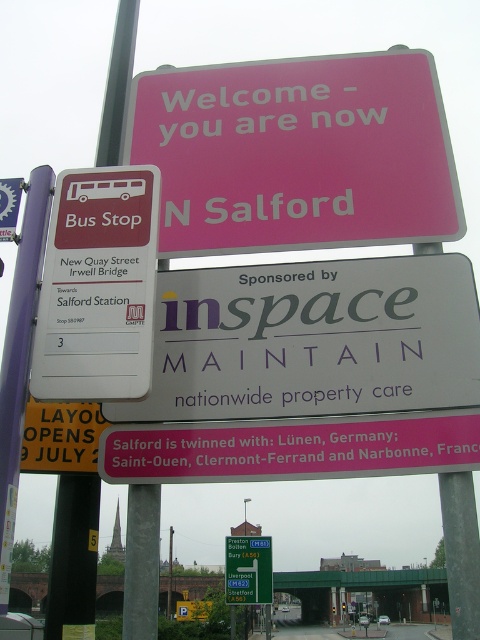
Question: Can you confirm if pink plastic sign at upper center is thinner than green plastic bus stop sign at upper left?

Choices:
 (A) no
 (B) yes

Answer: (A)

Question: Which is nearer to the matte white bus stop sign at upper left?

Choices:
 (A) metallic pole at left
 (B) green plastic bus stop sign at upper left
 (C) pink plastic sign at upper center

Answer: (C)

Question: Among these objects, which one is farthest from the camera?

Choices:
 (A) metallic pole at left
 (B) green plastic bus stop sign at upper left
 (C) pink plastic sign at upper center
 (D) matte white bus stop sign at upper left

Answer: (B)

Question: Observing the image, what is the correct spatial positioning of pink plastic sign at upper center in reference to matte white bus stop sign at upper left?

Choices:
 (A) left
 (B) right

Answer: (B)

Question: Does pink plastic sign at upper center come in front of matte white bus stop sign at upper left?

Choices:
 (A) yes
 (B) no

Answer: (B)

Question: Which object is positioned closest to the metallic pole at left?

Choices:
 (A) pink plastic sign at upper center
 (B) green plastic bus stop sign at upper left
 (C) matte white bus stop sign at upper left

Answer: (C)